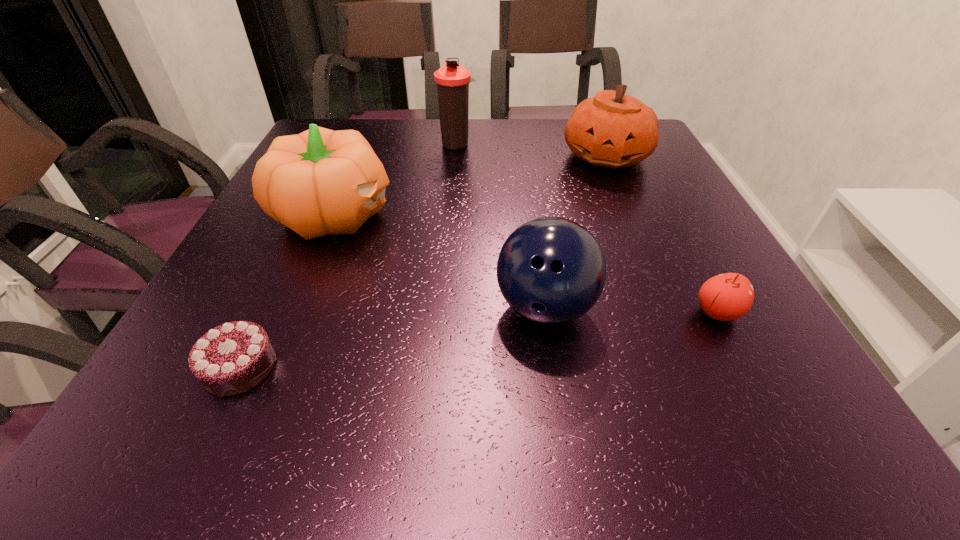
Where is `thermos bottle`? The height and width of the screenshot is (540, 960). thermos bottle is located at coordinates (452, 81).

You are a GUI agent. You are given a task and a screenshot of the screen. Output one action in this format:
    pyautogui.click(x=<x>, y=<y>)
    Task: Click on the left pumpkin
    Image resolution: width=960 pixels, height=540 pixels.
    Given the screenshot: What is the action you would take?
    pyautogui.click(x=319, y=182)

Identify the location of the nearer pumpkin. The width and height of the screenshot is (960, 540). (319, 182).

At what (x,y) coordinates should I click in order to perform the action: click on the right pumpkin. Please return your answer as a coordinate pair (x, y). Image resolution: width=960 pixels, height=540 pixels. Looking at the image, I should click on (612, 129).

Where is `the third object from right to left`? This screenshot has width=960, height=540. the third object from right to left is located at coordinates (551, 270).

Locate an element on the screen. The image size is (960, 540). apple is located at coordinates (726, 297).

Where is `the shortest object`? the shortest object is located at coordinates (232, 358).

Where is `vacant space located on the front of the fourth object from right to left`? vacant space located on the front of the fourth object from right to left is located at coordinates coord(454,180).

Locate an element on the screen. vacant space located on the carved face of the third farthest object is located at coordinates (526, 214).

At what (x,y) coordinates should I click in order to perform the action: click on vacant region located 0.250m on the front-facing side of the right pumpkin. Please return your answer as a coordinate pair (x, y). This screenshot has width=960, height=540. Looking at the image, I should click on (643, 242).